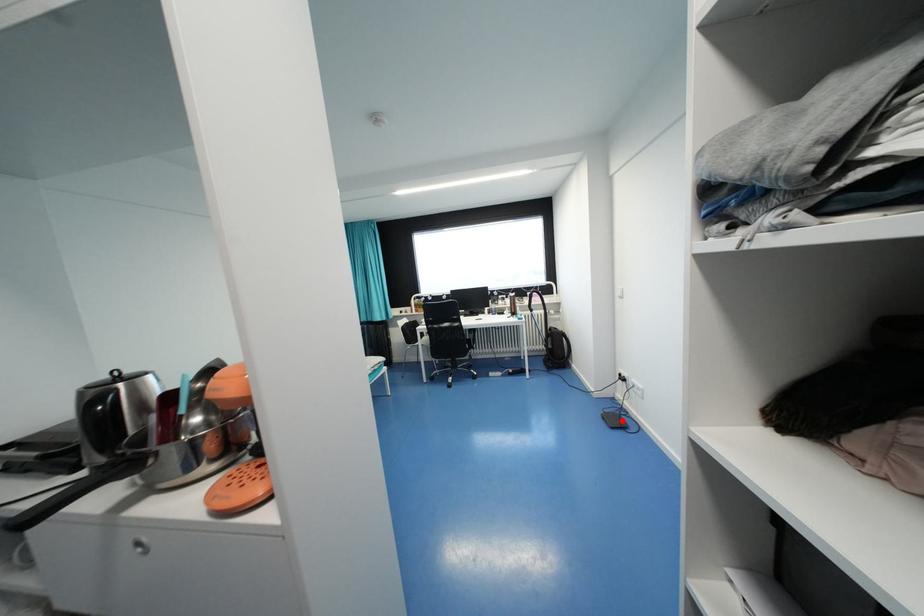
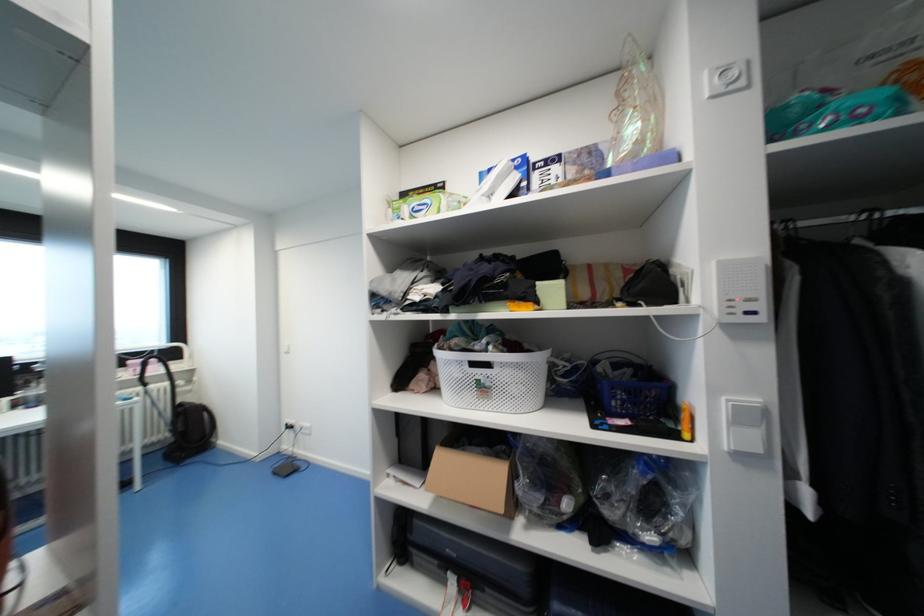
Question: A red point is marked in image1. In image2, is the corresponding 3D point closer to the camera or farther? Reply with the corresponding letter.

Choices:
 (A) The corresponding 3D point is closer.
 (B) The corresponding 3D point is farther.

Answer: (B)